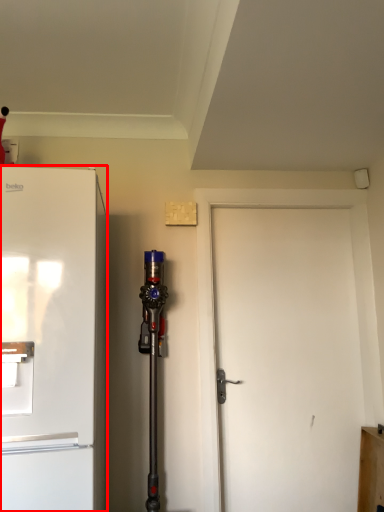
Question: Where is refrigerator (annotated by the red box) located in relation to door in the image?

Choices:
 (A) right
 (B) left

Answer: (B)